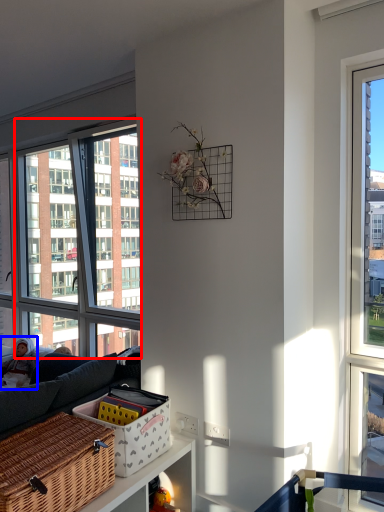
Question: Which object is closer to the camera taking this photo, window (highlighted by a red box) or couple (highlighted by a blue box)?

Choices:
 (A) window
 (B) couple

Answer: (A)